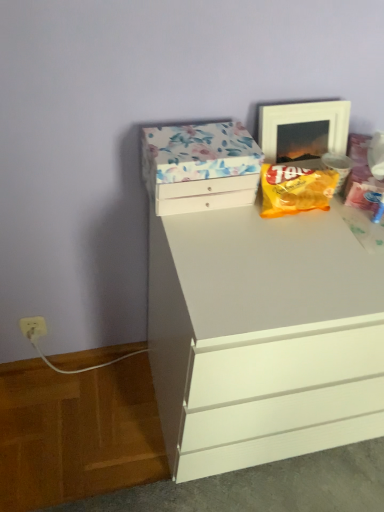
Where is `vacant region above floral paper-covered box at upper center (from a real-world perspective)`? This screenshot has width=384, height=512. vacant region above floral paper-covered box at upper center (from a real-world perspective) is located at coordinates (203, 139).